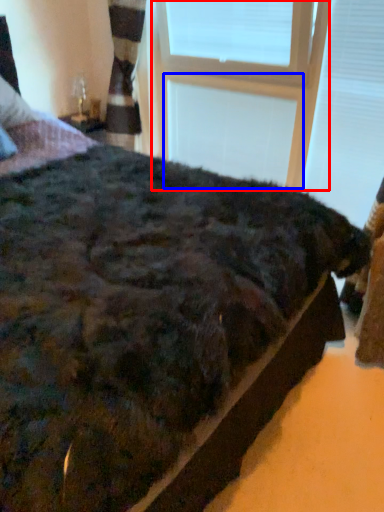
Question: Which of the following is the closest to the observer, window frame (highlighted by a red box) or window frame (highlighted by a blue box)?

Choices:
 (A) window frame
 (B) window frame

Answer: (A)